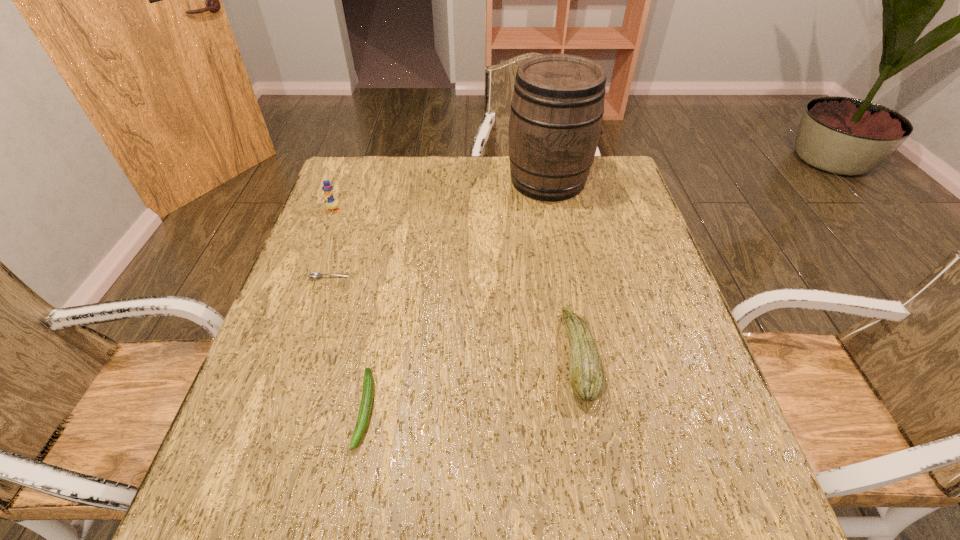
Find the location of a particular element. This screenshot has height=540, width=960. blank region between the taller zucchini and the tallest object is located at coordinates (564, 268).

You are a GUI agent. You are given a task and a screenshot of the screen. Output one action in this format:
    pyautogui.click(x=<x>, y=<y>)
    Task: Click on the unoccupied position between the taller zucchini and the tallest object
    
    Given the screenshot: What is the action you would take?
    click(564, 268)

Locate an element on the screen. The height and width of the screenshot is (540, 960). free area in between the second farthest object and the right zucchini is located at coordinates (456, 284).

This screenshot has height=540, width=960. Find the location of `vacant area that lies between the farthest object and the fourth shortest object`. vacant area that lies between the farthest object and the fourth shortest object is located at coordinates (441, 195).

What are the coordinates of `free space between the wine bucket and the third farthest object` in the screenshot? It's located at (440, 229).

Locate an element on the screen. free space that is in between the second tallest object and the shorter zucchini is located at coordinates (349, 309).

Find the location of `free spot between the fourth shortest object and the third farthest object`. free spot between the fourth shortest object and the third farthest object is located at coordinates (331, 244).

Identify the location of free space between the right zucchini and the fourth shortest object. (456, 284).

Find the location of a particular element. This screenshot has height=540, width=960. object that stands as the fourth closest to the right zucchini is located at coordinates (331, 203).

In order to click on the second closest object to the right zucchini in this screenshot , I will do `click(557, 107)`.